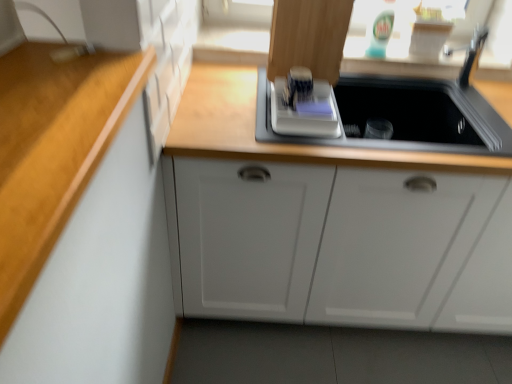
Locate an element on the screen. vacant space in front of white plastic cutting board at upper center is located at coordinates (295, 139).